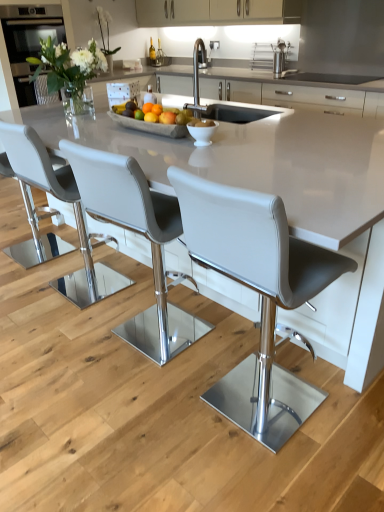
Identify the location of free space between matte gray chair at center, which is the 1th chair in right-to-left order, and white leather stool at center, the 2th chair when ordered from right to left. (196, 366).